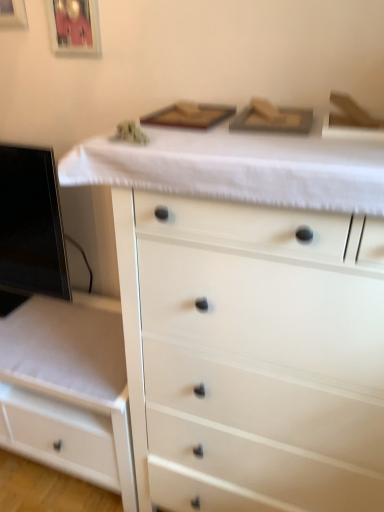
What do you see at coordinates (246, 328) in the screenshot?
I see `white matte chest of drawers at center, which is counted as the 1th chest of drawers, starting from the right` at bounding box center [246, 328].

What do you see at coordinates (69, 390) in the screenshot? The width and height of the screenshot is (384, 512). I see `white glossy drawer at lower left, which is the 2th chest of drawers in right-to-left order` at bounding box center [69, 390].

Looking at this image, measure the distance between point (17, 3) and camera.

A distance of 1.34 meters exists between point (17, 3) and camera.

I want to click on black glossy computer monitor at left, so click(30, 228).

Based on the photo, what's the angular difference between matte glass picture frame at upper left, which is counted as the second picture frame, starting from the left, and white fabric at upper center's facing directions?

matte glass picture frame at upper left, which is counted as the second picture frame, starting from the left, and white fabric at upper center are facing 1.12 degrees away from each other.

From a real-world perspective, relative to white fabric at upper center, is matte glass picture frame at upper left, which is counted as the second picture frame, starting from the left, vertically above or below?

In terms of real-world spatial position, matte glass picture frame at upper left, which is counted as the second picture frame, starting from the left, is above white fabric at upper center.

Is point (89, 24) less distant than point (127, 152)?

No, (89, 24) is further to viewer.

In the scene shown: Looking at the image, does matte glass picture frame at upper left, which is counted as the second picture frame, starting from the left, seem bigger or smaller compared to white fabric at upper center?

Considering their sizes, matte glass picture frame at upper left, which is counted as the second picture frame, starting from the left, takes up less space than white fabric at upper center.

From the image's perspective, between white fabric at upper center and black glossy computer monitor at left, who is located below?

From the image's view, black glossy computer monitor at left is below.

Considering the relative positions of white fabric at upper center and black glossy computer monitor at left in the image provided, is white fabric at upper center to the left of black glossy computer monitor at left from the viewer's perspective?

No, white fabric at upper center is not to the left of black glossy computer monitor at left.

Can you confirm if white fabric at upper center is wider than black glossy computer monitor at left?

Yes, white fabric at upper center is wider than black glossy computer monitor at left.

How far apart are white fabric at upper center and black glossy computer monitor at left?

white fabric at upper center is 28.91 inches from black glossy computer monitor at left.

From the image's perspective, which object appears higher, white matte chest of drawers at center, which is counted as the 1th chest of drawers, starting from the right, or white glossy drawer at lower left, which is the 2th chest of drawers in right-to-left order?

From the image's view, white matte chest of drawers at center, which is counted as the 1th chest of drawers, starting from the right, is above.

Considering the positions of objects white matte chest of drawers at center, which is counted as the 1th chest of drawers, starting from the right, and white glossy drawer at lower left, which is the first chest of drawers from left to right, in the image provided, who is more to the left, white matte chest of drawers at center, which is counted as the 1th chest of drawers, starting from the right, or white glossy drawer at lower left, which is the first chest of drawers from left to right,?

white glossy drawer at lower left, which is the first chest of drawers from left to right.

Considering the sizes of objects white matte chest of drawers at center, which is counted as the 1th chest of drawers, starting from the right, and white glossy drawer at lower left, which is the 2th chest of drawers in right-to-left order, in the image provided, who is smaller, white matte chest of drawers at center, which is counted as the 1th chest of drawers, starting from the right, or white glossy drawer at lower left, which is the 2th chest of drawers in right-to-left order,?

With smaller size is white glossy drawer at lower left, which is the 2th chest of drawers in right-to-left order.

How distant is white matte chest of drawers at center, which is counted as the 1th chest of drawers, starting from the right, from white glossy drawer at lower left, which is the first chest of drawers from left to right?

white matte chest of drawers at center, which is counted as the 1th chest of drawers, starting from the right, is 16.63 inches away from white glossy drawer at lower left, which is the first chest of drawers from left to right.

Considering the relative positions of metallic silver picture frame at upper left, which appears as the 2th picture frame when viewed from the right, and white glossy drawer at lower left, which is the first chest of drawers from left to right, in the image provided, is metallic silver picture frame at upper left, which appears as the 2th picture frame when viewed from the right, behind white glossy drawer at lower left, which is the first chest of drawers from left to right,?

That is True.

Does point (2, 15) lie in front of point (80, 328)?

Yes, point (2, 15) is closer to viewer.

Is metallic silver picture frame at upper left, the first picture frame when ordered from left to right, oriented towards white glossy drawer at lower left, which is the first chest of drawers from left to right?

No, metallic silver picture frame at upper left, the first picture frame when ordered from left to right, is not turned towards white glossy drawer at lower left, which is the first chest of drawers from left to right.

From a real-world perspective, does metallic silver picture frame at upper left, which appears as the 2th picture frame when viewed from the right, stand above white glossy drawer at lower left, which is the first chest of drawers from left to right?

Yes.

From their relative heights in the image, would you say matte glass picture frame at upper left, which is counted as the second picture frame, starting from the left, is taller or shorter than white matte chest of drawers at center, the second chest of drawers when ordered from left to right?

matte glass picture frame at upper left, which is counted as the second picture frame, starting from the left, is shorter than white matte chest of drawers at center, the second chest of drawers when ordered from left to right.

Are matte glass picture frame at upper left, which is counted as the second picture frame, starting from the left, and white matte chest of drawers at center, which is counted as the 1th chest of drawers, starting from the right, making contact?

No, matte glass picture frame at upper left, which is counted as the second picture frame, starting from the left, is not beside white matte chest of drawers at center, which is counted as the 1th chest of drawers, starting from the right.

Considering the sizes of objects matte glass picture frame at upper left, the 1th picture frame in the right-to-left sequence, and white matte chest of drawers at center, which is counted as the 1th chest of drawers, starting from the right, in the image provided, who is thinner, matte glass picture frame at upper left, the 1th picture frame in the right-to-left sequence, or white matte chest of drawers at center, which is counted as the 1th chest of drawers, starting from the right,?

With smaller width is matte glass picture frame at upper left, the 1th picture frame in the right-to-left sequence.

Is point (81, 15) farther from viewer compared to point (136, 429)?

No.

Can you confirm if white fabric at upper center is thinner than metallic silver picture frame at upper left, which appears as the 2th picture frame when viewed from the right?

In fact, white fabric at upper center might be wider than metallic silver picture frame at upper left, which appears as the 2th picture frame when viewed from the right.

From a real-world perspective, which object rests below the other?

In real-world perspective, white fabric at upper center is lower.

Does white fabric at upper center have a smaller size compared to metallic silver picture frame at upper left, which appears as the 2th picture frame when viewed from the right?

No.

You are a GUI agent. You are given a task and a screenshot of the screen. Output one action in this format:
    pyautogui.click(x=<x>, y=<y>)
    Task: Click on the picture frame that is the 1st one above the white matte chest of drawers at center, the second chest of drawers when ordered from left to right (from a real-world perspective)
    Image resolution: width=384 pixels, height=512 pixels.
    Given the screenshot: What is the action you would take?
    pyautogui.click(x=74, y=26)

Is matte glass picture frame at upper left, the 1th picture frame in the right-to-left sequence, located within white matte chest of drawers at center, which is counted as the 1th chest of drawers, starting from the right?

Definitely not — matte glass picture frame at upper left, the 1th picture frame in the right-to-left sequence, is not inside white matte chest of drawers at center, which is counted as the 1th chest of drawers, starting from the right.

Is white matte chest of drawers at center, which is counted as the 1th chest of drawers, starting from the right, far from matte glass picture frame at upper left, the 1th picture frame in the right-to-left sequence?

Actually, white matte chest of drawers at center, which is counted as the 1th chest of drawers, starting from the right, and matte glass picture frame at upper left, the 1th picture frame in the right-to-left sequence, are a little close together.

Based on their sizes in the image, would you say white matte chest of drawers at center, which is counted as the 1th chest of drawers, starting from the right, is bigger or smaller than matte glass picture frame at upper left, which is counted as the second picture frame, starting from the left?

white matte chest of drawers at center, which is counted as the 1th chest of drawers, starting from the right, is bigger than matte glass picture frame at upper left, which is counted as the second picture frame, starting from the left.

Find the location of `counter top located in front of the matte glass picture frame at upper left, the 1th picture frame in the right-to-left sequence`. counter top located in front of the matte glass picture frame at upper left, the 1th picture frame in the right-to-left sequence is located at coordinates (238, 167).

Find the location of a particular element. Image resolution: width=384 pixels, height=512 pixels. computer monitor that is on the left side of white fabric at upper center is located at coordinates (30, 228).

Based on their spatial positions, is metallic silver picture frame at upper left, which appears as the 2th picture frame when viewed from the right, or white fabric at upper center further from white glossy drawer at lower left, which is the first chest of drawers from left to right?

The object further to white glossy drawer at lower left, which is the first chest of drawers from left to right, is metallic silver picture frame at upper left, which appears as the 2th picture frame when viewed from the right.

Looking at the image, which one is located closer to white glossy drawer at lower left, which is the first chest of drawers from left to right, white matte chest of drawers at center, the second chest of drawers when ordered from left to right, or matte glass picture frame at upper left, the 1th picture frame in the right-to-left sequence?

Among the two, white matte chest of drawers at center, the second chest of drawers when ordered from left to right, is located nearer to white glossy drawer at lower left, which is the first chest of drawers from left to right.

Looking at this image, based on their spatial positions, is white glossy drawer at lower left, which is the first chest of drawers from left to right, or black glossy computer monitor at left further from white fabric at upper center?

white glossy drawer at lower left, which is the first chest of drawers from left to right.

Based on their spatial positions, is matte glass picture frame at upper left, the 1th picture frame in the right-to-left sequence, or white matte chest of drawers at center, the second chest of drawers when ordered from left to right, further from black glossy computer monitor at left?

white matte chest of drawers at center, the second chest of drawers when ordered from left to right.

Looking at the image, which one is located closer to white fabric at upper center, white glossy drawer at lower left, which is the first chest of drawers from left to right, or metallic silver picture frame at upper left, which appears as the 2th picture frame when viewed from the right?

The object closer to white fabric at upper center is white glossy drawer at lower left, which is the first chest of drawers from left to right.

Looking at the image, which one is located further to black glossy computer monitor at left, white fabric at upper center or matte glass picture frame at upper left, the 1th picture frame in the right-to-left sequence?

Among the two, white fabric at upper center is located further to black glossy computer monitor at left.

From the image, which object appears to be nearer to white glossy drawer at lower left, which is the 2th chest of drawers in right-to-left order, black glossy computer monitor at left or white fabric at upper center?

black glossy computer monitor at left is positioned closer to the anchor white glossy drawer at lower left, which is the 2th chest of drawers in right-to-left order.

Based on their spatial positions, is white matte chest of drawers at center, the second chest of drawers when ordered from left to right, or white fabric at upper center further from white glossy drawer at lower left, which is the 2th chest of drawers in right-to-left order?

Based on the image, white fabric at upper center appears to be further to white glossy drawer at lower left, which is the 2th chest of drawers in right-to-left order.

The image size is (384, 512). What are the coordinates of `chest of drawers between black glossy computer monitor at left and white matte chest of drawers at center, the second chest of drawers when ordered from left to right, from left to right` in the screenshot? It's located at (69, 390).

Find the location of a particular element. picture frame between metallic silver picture frame at upper left, which appears as the 2th picture frame when viewed from the right, and white matte chest of drawers at center, the second chest of drawers when ordered from left to right, in the up-down direction is located at coordinates (74, 26).

Where is `counter top between metallic silver picture frame at upper left, the first picture frame when ordered from left to right, and white matte chest of drawers at center, the second chest of drawers when ordered from left to right, in the up-down direction`? counter top between metallic silver picture frame at upper left, the first picture frame when ordered from left to right, and white matte chest of drawers at center, the second chest of drawers when ordered from left to right, in the up-down direction is located at coordinates (238, 167).

Locate an element on the screen. Image resolution: width=384 pixels, height=512 pixels. computer monitor between metallic silver picture frame at upper left, which appears as the 2th picture frame when viewed from the right, and white glossy drawer at lower left, which is the first chest of drawers from left to right, in the vertical direction is located at coordinates (30, 228).